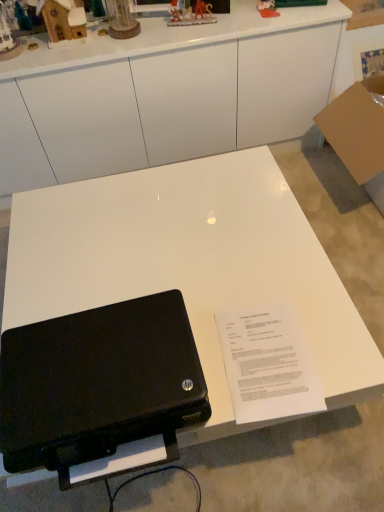
Identify the location of free spot below white paper at center (from a real-world perspective). The width and height of the screenshot is (384, 512). (266, 362).